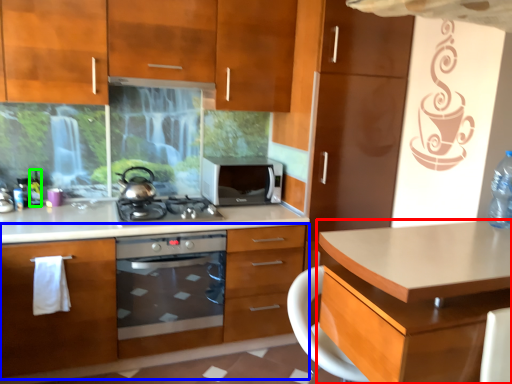
Question: Estimate the real-world distances between objects in this image. Which object is closer to desk (highlighted by a red box), cabinetry (highlighted by a blue box) or bottle (highlighted by a green box)?

Choices:
 (A) cabinetry
 (B) bottle

Answer: (A)